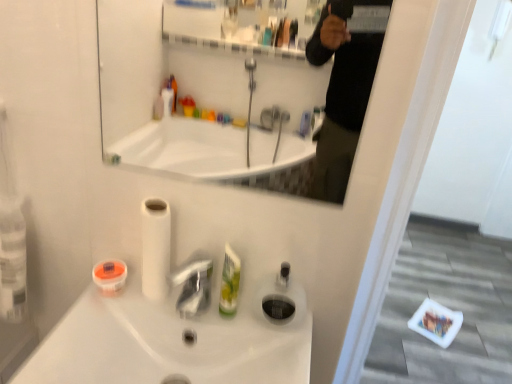
Identify the location of vacant area that lies to the right of green plastic mouthwash at center, which is counted as the second mouthwash, starting from the left. This screenshot has width=512, height=384. (278, 342).